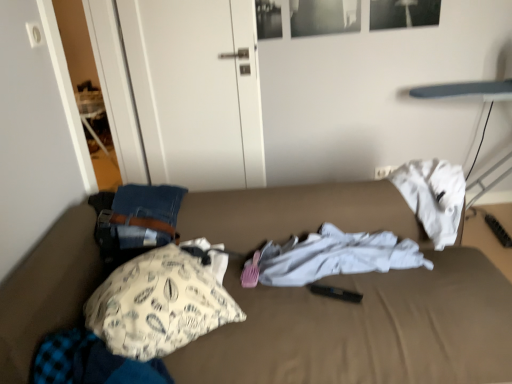
Question: From a real-world perspective, relative to white matte door at upper left, is brown fabric bed at center vertically above or below?

Choices:
 (A) above
 (B) below

Answer: (B)

Question: In terms of height, does brown fabric bed at center look taller or shorter compared to white matte door at upper left?

Choices:
 (A) tall
 (B) short

Answer: (B)

Question: Estimate the real-world distances between objects in this image. Which object is closer to the white printed fabric pillow at left?

Choices:
 (A) white matte door at upper left
 (B) white cotton shirt at center, the 1th clothing positioned from the back
 (C) fluffy blue blanket at lower left, positioned as the second clothing in top-to-bottom order
 (D) brown fabric bed at center

Answer: (C)

Question: Estimate the real-world distances between objects in this image. Which object is farther from the brown fabric bed at center?

Choices:
 (A) fluffy blue blanket at lower left, placed as the first clothing when sorted from front to back
 (B) white printed fabric pillow at left
 (C) white cotton shirt at center, the 1th clothing in the top-to-bottom sequence
 (D) white matte door at upper left

Answer: (D)